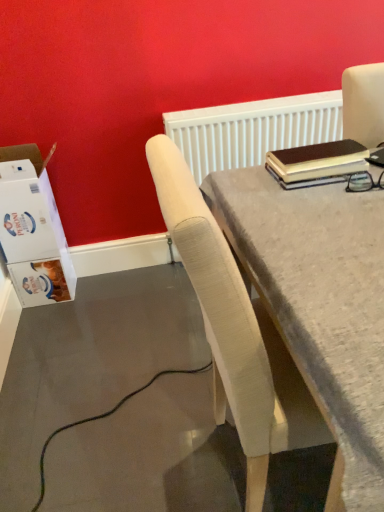
You are a GUI agent. You are given a task and a screenshot of the screen. Output one action in this format:
    pyautogui.click(x=<x>, y=<y>)
    Task: Click on the light beige fabric chair at center
    The width and height of the screenshot is (384, 512).
    Given the screenshot: What is the action you would take?
    pyautogui.click(x=235, y=331)

Image resolution: width=384 pixels, height=512 pixels. Describe the element at coordinates (34, 236) in the screenshot. I see `white cardboard box at left` at that location.

Find the location of `white textured radiator at upper center`. white textured radiator at upper center is located at coordinates (253, 130).

In order to click on light beige fabric chair at center in this screenshot , I will do `click(235, 331)`.

Which object is more forward, white cardboard box at left or light beige fabric chair at center?

light beige fabric chair at center is more forward.

Is light beige fabric chair at center at the back of white cardboard box at left?

No, light beige fabric chair at center is not at the back of white cardboard box at left.

Considering the positions of objects white cardboard box at left and light beige fabric chair at center in the image provided, who is more to the left, white cardboard box at left or light beige fabric chair at center?

From the viewer's perspective, white cardboard box at left appears more on the left side.

Considering the sizes of objects light beige fabric chair at center and white textured radiator at upper center in the image provided, who is smaller, light beige fabric chair at center or white textured radiator at upper center?

white textured radiator at upper center.

Find the location of a particular element. This screenshot has width=384, height=512. radiator on the left of the light beige fabric chair at center is located at coordinates (253, 130).

Which of these two, light beige fabric chair at center or white textured radiator at upper center, is thinner?

Thinner between the two is white textured radiator at upper center.

Which is more to the left, light beige fabric chair at center or white textured radiator at upper center?

Positioned to the left is white textured radiator at upper center.

Considering the positions of objects light beige fabric chair at center and white cardboard box at left in the image provided, who is behind, light beige fabric chair at center or white cardboard box at left?

white cardboard box at left.

Does light beige fabric chair at center have a lesser width compared to white cardboard box at left?

Incorrect, the width of light beige fabric chair at center is not less than that of white cardboard box at left.

Consider the image. From the image's perspective, is light beige fabric chair at center positioned above or below white cardboard box at left?

Clearly, from the image's perspective, light beige fabric chair at center is below white cardboard box at left.

From the picture: From the image's perspective, would you say white textured radiator at upper center is positioned over white cardboard box at left?

Yes, from the image's perspective, white textured radiator at upper center is on top of white cardboard box at left.

From a real-world perspective, is white textured radiator at upper center on top of white cardboard box at left?

Yes.

Is white textured radiator at upper center turned away from white cardboard box at left?

No, white textured radiator at upper center's orientation is not away from white cardboard box at left.

Who is bigger, white cardboard box at left or white textured radiator at upper center?

With larger size is white cardboard box at left.

Is white textured radiator at upper center inside white cardboard box at left?

No, white cardboard box at left does not contain white textured radiator at upper center.

Is white cardboard box at left far from white textured radiator at upper center?

Result: That's not correct — white cardboard box at left is a little close to white textured radiator at upper center.

Considering the sizes of white cardboard box at left and white textured radiator at upper center in the image, is white cardboard box at left wider or thinner than white textured radiator at upper center?

Considering their sizes, white cardboard box at left looks broader than white textured radiator at upper center.

Is light beige fabric chair at center at the back of white textured radiator at upper center?

That's not correct — white textured radiator at upper center is not looking away from light beige fabric chair at center.

Can you confirm if white textured radiator at upper center is bigger than light beige fabric chair at center?

No, white textured radiator at upper center is not bigger than light beige fabric chair at center.

Considering the relative sizes of white textured radiator at upper center and light beige fabric chair at center in the image provided, is white textured radiator at upper center taller than light beige fabric chair at center?

No, white textured radiator at upper center is not taller than light beige fabric chair at center.

This screenshot has width=384, height=512. In order to click on chair that is in front of the white cardboard box at left in this screenshot , I will do `click(235, 331)`.

In the image, there is a white textured radiator at upper center. Where is `chair below it (from the image's perspective)`? The image size is (384, 512). chair below it (from the image's perspective) is located at coordinates (235, 331).

When comparing their distances from white cardboard box at left, does white textured radiator at upper center or light beige fabric chair at center seem closer?

white textured radiator at upper center lies closer to white cardboard box at left than the other object.

Looking at the image, which one is located further to white cardboard box at left, light beige fabric chair at center or white textured radiator at upper center?

Based on the image, light beige fabric chair at center appears to be further to white cardboard box at left.

Estimate the real-world distances between objects in this image. Which object is further from light beige fabric chair at center, white textured radiator at upper center or white cardboard box at left?

Based on the image, white cardboard box at left appears to be further to light beige fabric chair at center.

Which object lies further to the anchor point white textured radiator at upper center, white cardboard box at left or light beige fabric chair at center?

light beige fabric chair at center is further to white textured radiator at upper center.

Which object lies further to the anchor point white textured radiator at upper center, light beige fabric chair at center or white cardboard box at left?

Among the two, light beige fabric chair at center is located further to white textured radiator at upper center.

From the image, which object appears to be nearer to light beige fabric chair at center, white cardboard box at left or white textured radiator at upper center?

Among the two, white textured radiator at upper center is located nearer to light beige fabric chair at center.

This screenshot has height=512, width=384. Find the location of `box located between light beige fabric chair at center and white textured radiator at upper center in the depth direction`. box located between light beige fabric chair at center and white textured radiator at upper center in the depth direction is located at coordinates (34, 236).